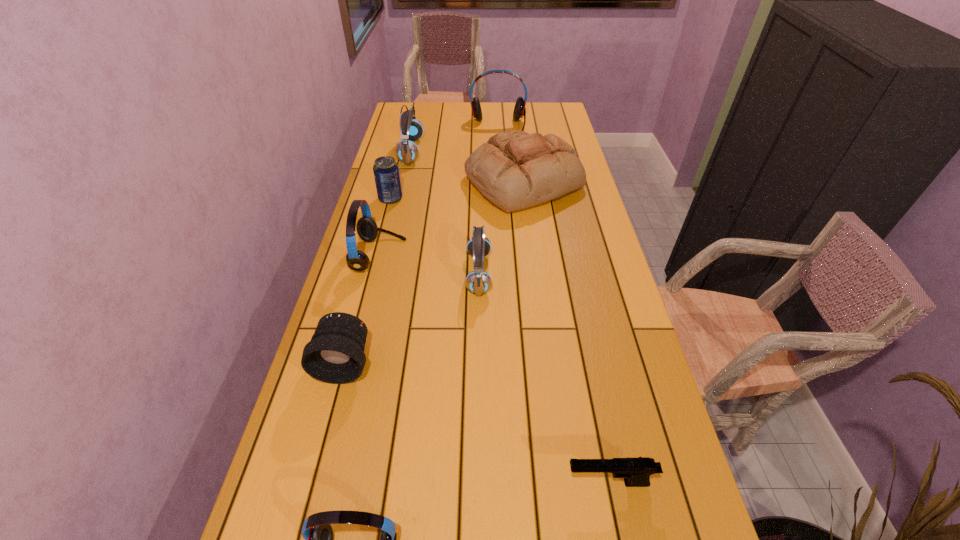
What are the coordinates of `the biggest red headset` in the screenshot? It's located at (519, 110).

This screenshot has height=540, width=960. Identify the location of the tallest object. (519, 110).

You are a GUI agent. You are given a task and a screenshot of the screen. Output one action in this format:
    pyautogui.click(x=<x>, y=<y>)
    Task: Click on the second farthest headset
    Image resolution: width=960 pixels, height=540 pixels.
    Given the screenshot: What is the action you would take?
    pyautogui.click(x=406, y=151)

Locate an element on the screen. This screenshot has height=540, width=960. the bigger blue headset is located at coordinates (406, 151).

The image size is (960, 540). What are the coordinates of `bread` in the screenshot? It's located at pyautogui.click(x=515, y=170).

Locate an element on the screen. the second farthest red headset is located at coordinates (366, 227).

This screenshot has width=960, height=540. I want to click on soda, so 386,171.

The width and height of the screenshot is (960, 540). In order to click on the smaller blue headset in this screenshot , I will do (478, 281).

This screenshot has width=960, height=540. I want to click on the nearer blue headset, so click(x=478, y=281).

You are a GUI agent. You are given a task and a screenshot of the screen. Output one action in this format:
    pyautogui.click(x=<x>, y=<y>)
    Task: Click on the third nearest object
    
    Given the screenshot: What is the action you would take?
    pyautogui.click(x=335, y=354)